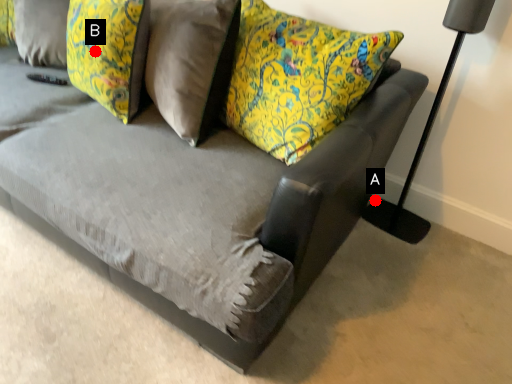
Question: Two points are circled on the image, labeled by A and B beside each circle. Among these points, which one is farthest from the camera?

Choices:
 (A) A is further
 (B) B is further

Answer: (A)